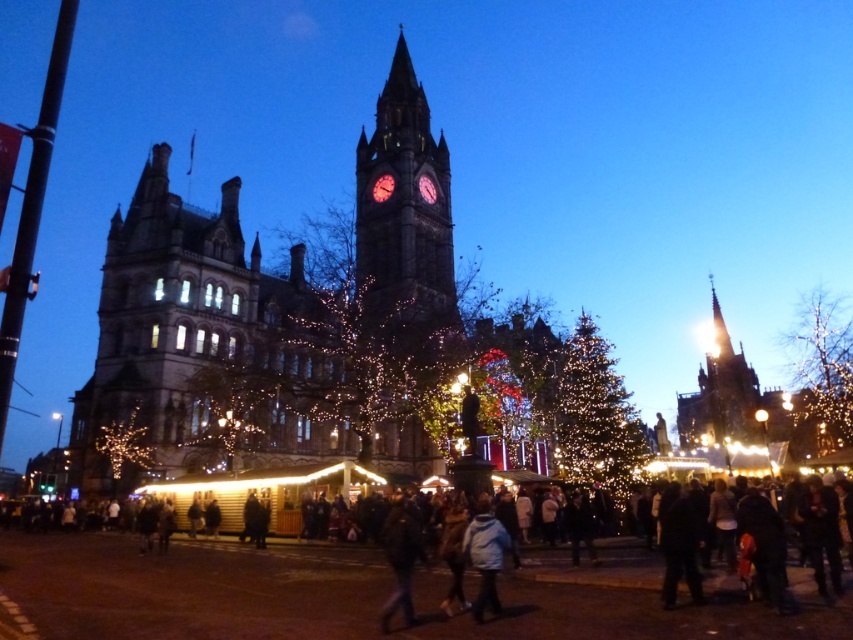
Question: Among these points, which one is nearest to the camera?

Choices:
 (A) (393, 116)
 (B) (701, 387)

Answer: (A)

Question: Is polished stone clock tower at center smaller than shiny gold spire at center right?

Choices:
 (A) no
 (B) yes

Answer: (A)

Question: Considering the relative positions of polished stone clock tower at center and shiny gold spire at center right in the image provided, where is polished stone clock tower at center located with respect to shiny gold spire at center right?

Choices:
 (A) left
 (B) right

Answer: (A)

Question: Among these objects, which one is nearest to the camera?

Choices:
 (A) shiny gold spire at center right
 (B) polished stone clock tower at center

Answer: (B)

Question: Which object appears closest to the camera in this image?

Choices:
 (A) shiny gold spire at center right
 (B) polished stone clock tower at center

Answer: (B)

Question: Is the position of polished stone clock tower at center less distant than that of shiny gold spire at center right?

Choices:
 (A) no
 (B) yes

Answer: (B)